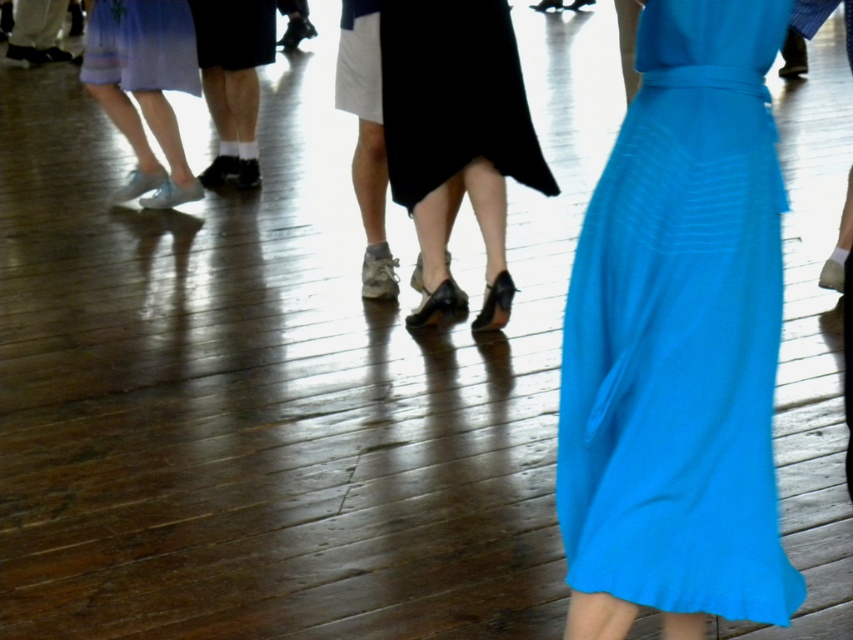
Which is behind, point (421, 141) or point (257, 4)?

The point (257, 4) is behind.

Is black satin skirt at center wider than matte black skirt at center?

Yes.

This screenshot has width=853, height=640. I want to click on black satin skirt at center, so click(453, 96).

Based on the photo, does matte blue dress at upper left appear under black matte skirt at center?

Yes, matte blue dress at upper left is below black matte skirt at center.

Which is behind, point (154, 51) or point (199, 10)?

Positioned behind is point (199, 10).

Is point (170, 77) in front of point (242, 38)?

Yes, point (170, 77) is in front of point (242, 38).

I want to click on matte blue dress at upper left, so click(x=140, y=45).

Is point (746, 468) behind point (238, 72)?

No, (746, 468) is in front of (238, 72).

Identify the location of matte blue dress at center. (680, 332).